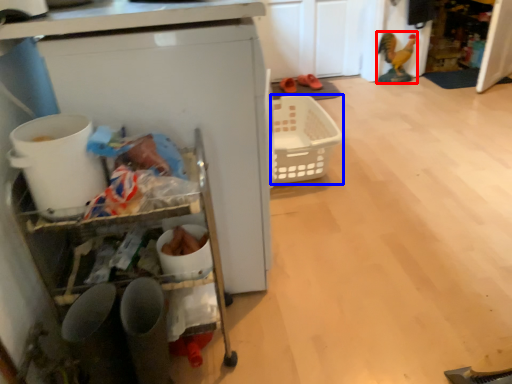
Question: Which of the following is the farthest to the observer, toy (highlighted by a red box) or basket (highlighted by a blue box)?

Choices:
 (A) toy
 (B) basket

Answer: (A)